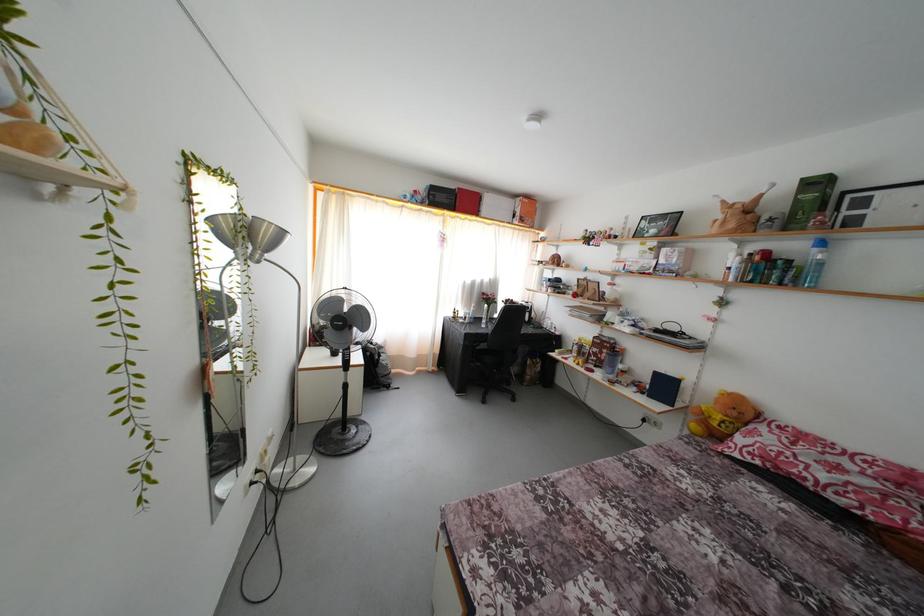
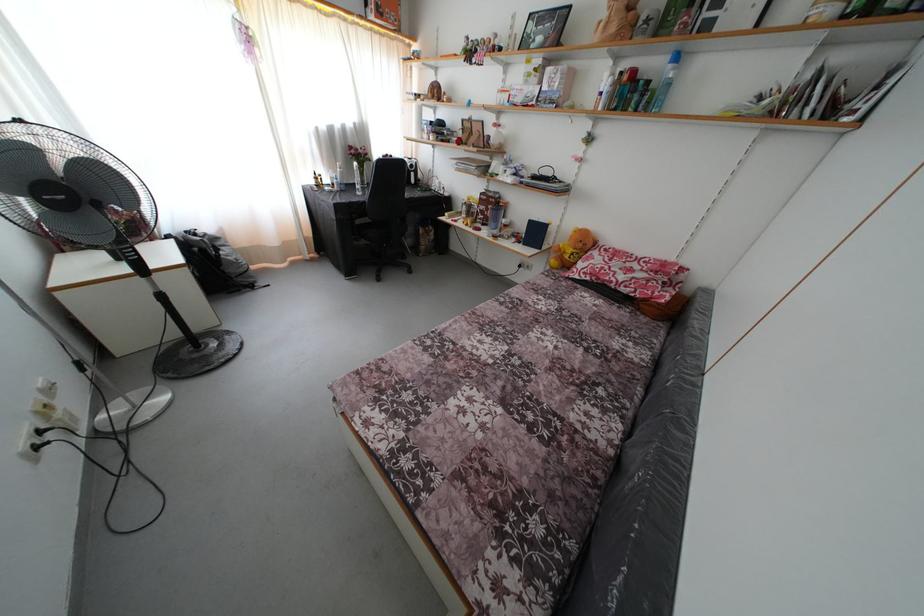
Locate, in the second image, the point that corresponds to the point at 649,426 in the first image.

(525, 272)